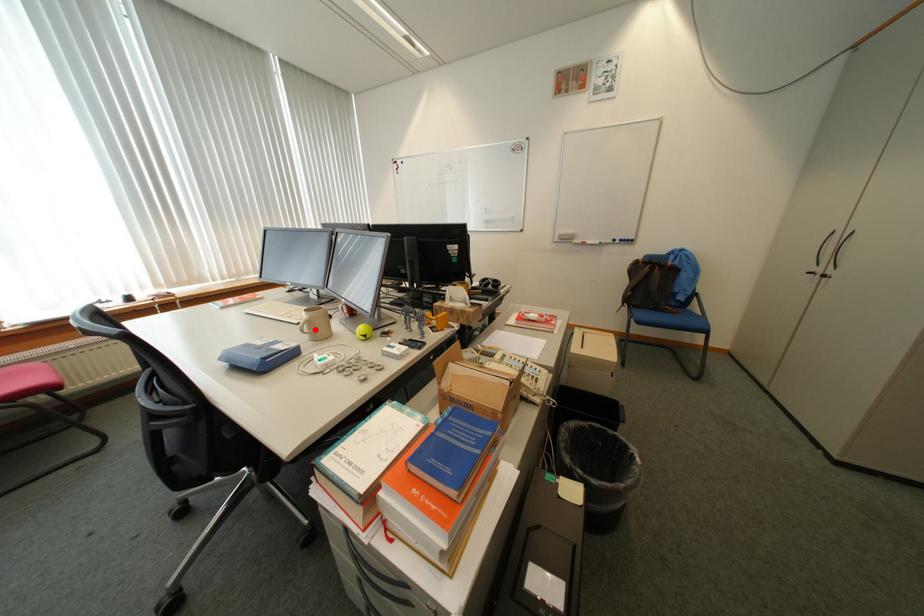
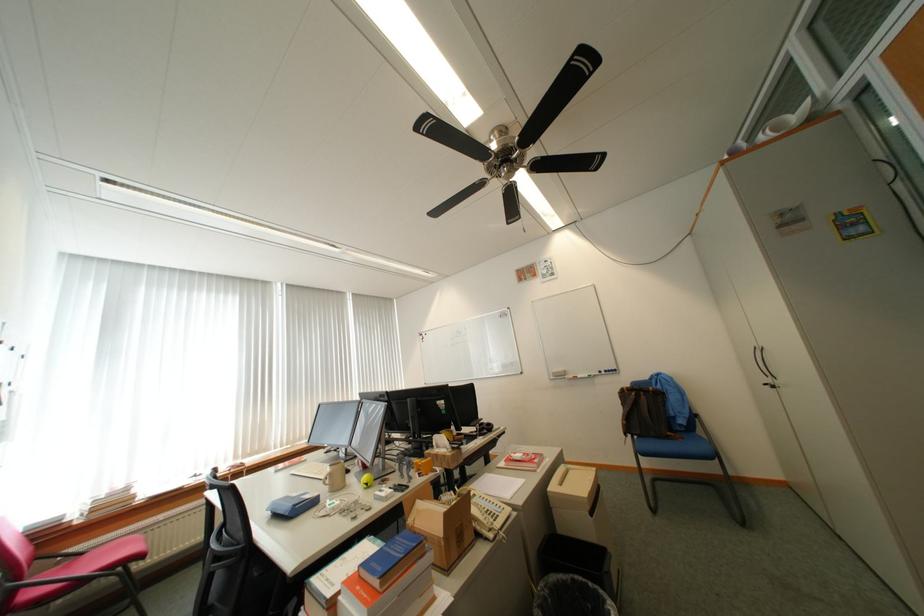
In the second image, find the point that corresponds to the highlighted location in the first image.

(336, 482)